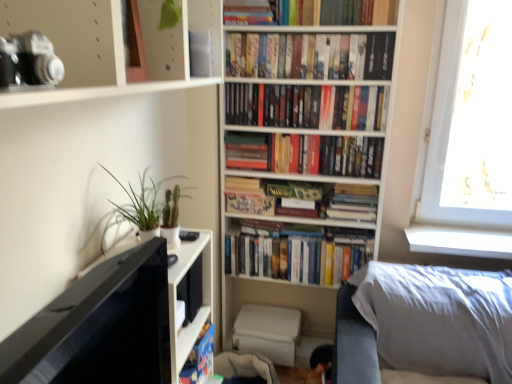
Where is `blank space situated above hardcover books at center, acting as the 4th book starting from the top (from a real-world perspective)`? This screenshot has height=384, width=512. blank space situated above hardcover books at center, acting as the 4th book starting from the top (from a real-world perspective) is located at coordinates (328, 134).